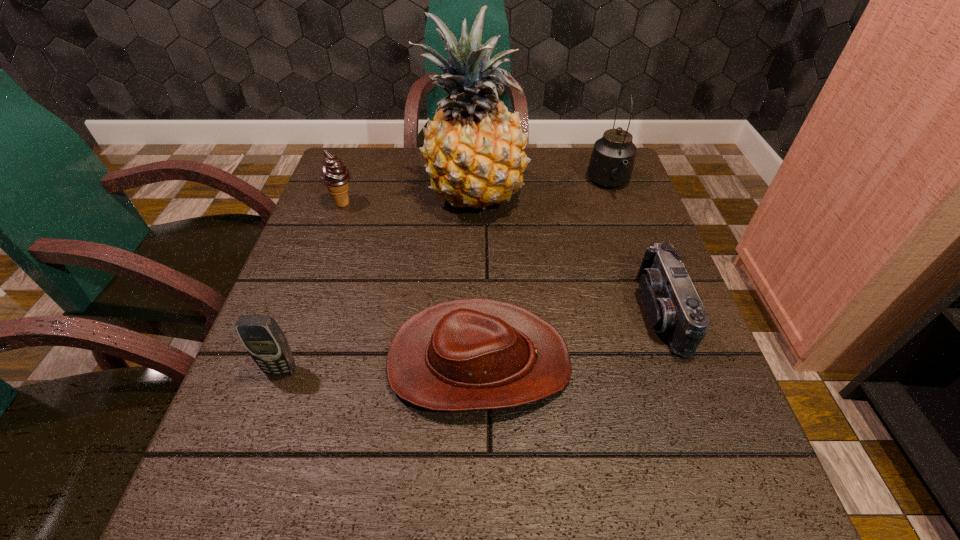
This screenshot has height=540, width=960. What are the coordinates of `vacant space situated on the front-facing side of the camcorder` in the screenshot? It's located at (473, 312).

Where is `free location located 0.080m on the front-facing side of the camcorder`? The height and width of the screenshot is (540, 960). free location located 0.080m on the front-facing side of the camcorder is located at coordinates (600, 312).

Find the location of `free spot located 0.190m on the front-facing side of the camcorder`. free spot located 0.190m on the front-facing side of the camcorder is located at coordinates (544, 312).

Identify the location of free point located 0.080m on the front-facing side of the cowboy hat. (614, 361).

Where is `pineapple that is at the far edge`? The height and width of the screenshot is (540, 960). pineapple that is at the far edge is located at coordinates (474, 148).

You are a GUI agent. You are given a task and a screenshot of the screen. Output one action in this format:
    pyautogui.click(x=<x>, y=<y>)
    Task: Click on the kettle located at the far edge
    Image resolution: width=960 pixels, height=540 pixels.
    Given the screenshot: What is the action you would take?
    pyautogui.click(x=611, y=164)

Find the location of `icecream positioned at the far edge`. icecream positioned at the far edge is located at coordinates (335, 176).

Identify the location of icecream located in the left edge section of the desktop. This screenshot has width=960, height=540. (335, 176).

Locate an element on the screen. The height and width of the screenshot is (540, 960). cellular telephone present at the left edge is located at coordinates (262, 337).

You are a GUI agent. You are given a task and a screenshot of the screen. Output one action in this format:
    pyautogui.click(x=<x>, y=<y>)
    Task: Click on the kettle located in the right edge section of the desktop
    This screenshot has width=960, height=540.
    Given the screenshot: What is the action you would take?
    pyautogui.click(x=611, y=164)